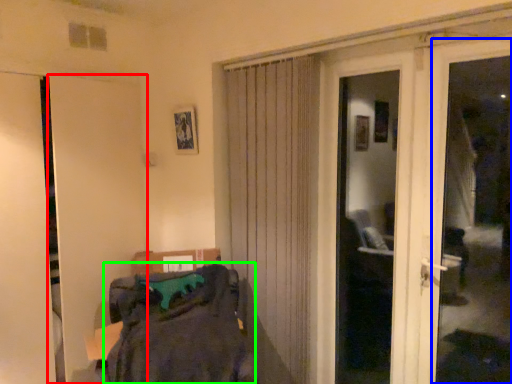
Question: Which is nearer to the door (highlighted by a red box)? window frame (highlighted by a blue box) or laundry (highlighted by a green box).

Choices:
 (A) window frame
 (B) laundry

Answer: (B)